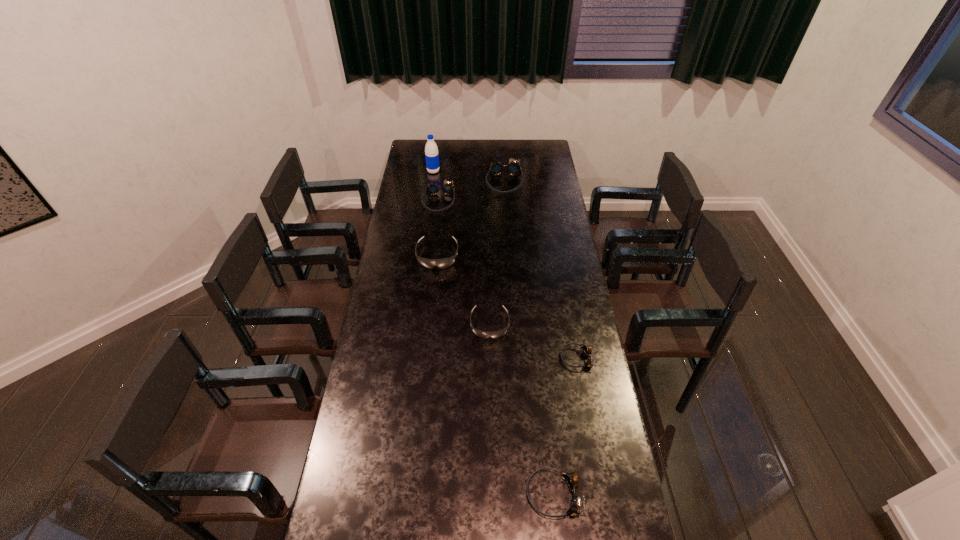
Locate an element on the screen. This screenshot has height=540, width=960. free location located 0.290m on the lenses of the smaller black goggles is located at coordinates (492, 410).

Find the location of a particular element. This screenshot has width=960, height=540. free location located 0.080m through the lenses of the sixth farthest object is located at coordinates (540, 358).

You are a GUI agent. You are given a task and a screenshot of the screen. Output one action in this format:
    pyautogui.click(x=<x>, y=<y>)
    Task: Click on the vacant space located through the lenses of the sixth farthest object
    This screenshot has height=540, width=960.
    Given the screenshot: What is the action you would take?
    pyautogui.click(x=484, y=358)

Find the location of a particular element. The width and height of the screenshot is (960, 540). blank space located through the lenses of the sixth farthest object is located at coordinates (513, 358).

Image resolution: width=960 pixels, height=540 pixels. I want to click on water bottle at the left edge, so click(431, 150).

In the image, there is a desktop. Identify the location of vacant space at the far edge. This screenshot has height=540, width=960. (443, 147).

This screenshot has height=540, width=960. In the image, there is a desktop. What are the coordinates of `vacant space at the left edge` in the screenshot? It's located at click(x=369, y=508).

Identify the location of vacant space at the right edge. (538, 202).

This screenshot has width=960, height=540. Identify the location of free space between the shortest object and the nearer black goggles. (534, 341).

This screenshot has width=960, height=540. In order to click on vacant space that is in between the second smallest bronze goggles and the fourth nearest object in this screenshot , I will do `click(495, 375)`.